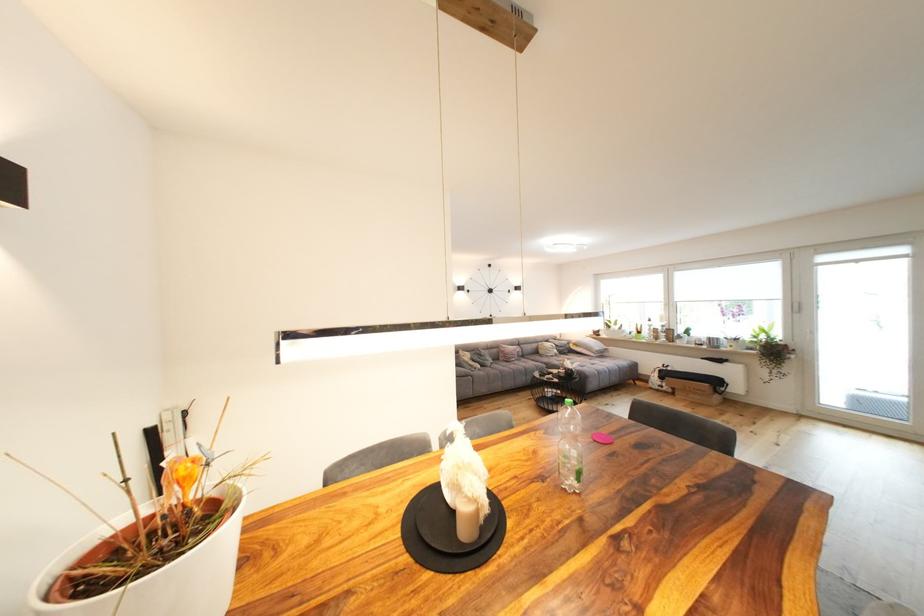
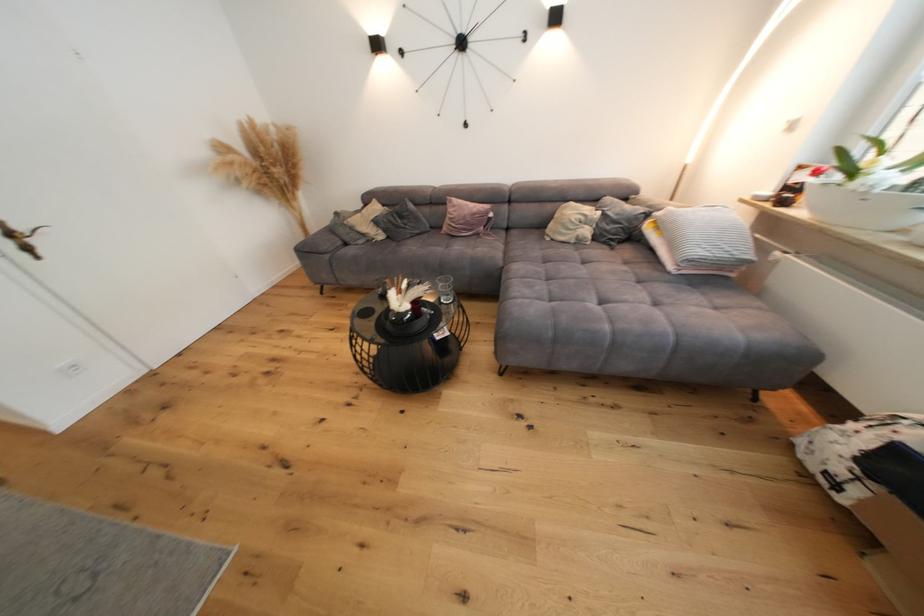
Find the pixel in the second image that matches point (603, 331) in the first image.

(809, 179)